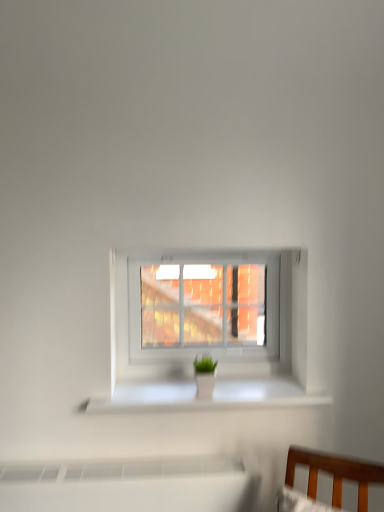
Question: Is white plastic window at center positioned with its back to white glossy planter at center?

Choices:
 (A) yes
 (B) no

Answer: (B)

Question: Can you confirm if white plastic window at center is smaller than white glossy planter at center?

Choices:
 (A) yes
 (B) no

Answer: (B)

Question: Is white plastic window at center in front of white glossy planter at center?

Choices:
 (A) yes
 (B) no

Answer: (B)

Question: From a real-world perspective, is white plastic window at center under white glossy planter at center?

Choices:
 (A) yes
 (B) no

Answer: (B)

Question: From the image's perspective, is white plastic window at center below white glossy planter at center?

Choices:
 (A) no
 (B) yes

Answer: (A)

Question: Does white plastic window at center appear on the left side of white glossy planter at center?

Choices:
 (A) yes
 (B) no

Answer: (B)

Question: Considering the relative sizes of white glossy planter at center and white plastic window at center in the image provided, is white glossy planter at center bigger than white plastic window at center?

Choices:
 (A) yes
 (B) no

Answer: (B)

Question: From the image's perspective, would you say white glossy planter at center is positioned over white plastic window at center?

Choices:
 (A) yes
 (B) no

Answer: (B)

Question: Considering the relative sizes of white glossy planter at center and white plastic window at center in the image provided, is white glossy planter at center wider than white plastic window at center?

Choices:
 (A) no
 (B) yes

Answer: (B)

Question: Does white glossy planter at center contain white plastic window at center?

Choices:
 (A) yes
 (B) no

Answer: (B)

Question: Does white glossy planter at center appear on the right side of white plastic window at center?

Choices:
 (A) yes
 (B) no

Answer: (B)

Question: Is white glossy planter at center further to camera compared to white plastic window at center?

Choices:
 (A) yes
 (B) no

Answer: (B)

Question: Is white glossy planter at center situated inside white plastic window at center or outside?

Choices:
 (A) outside
 (B) inside

Answer: (A)